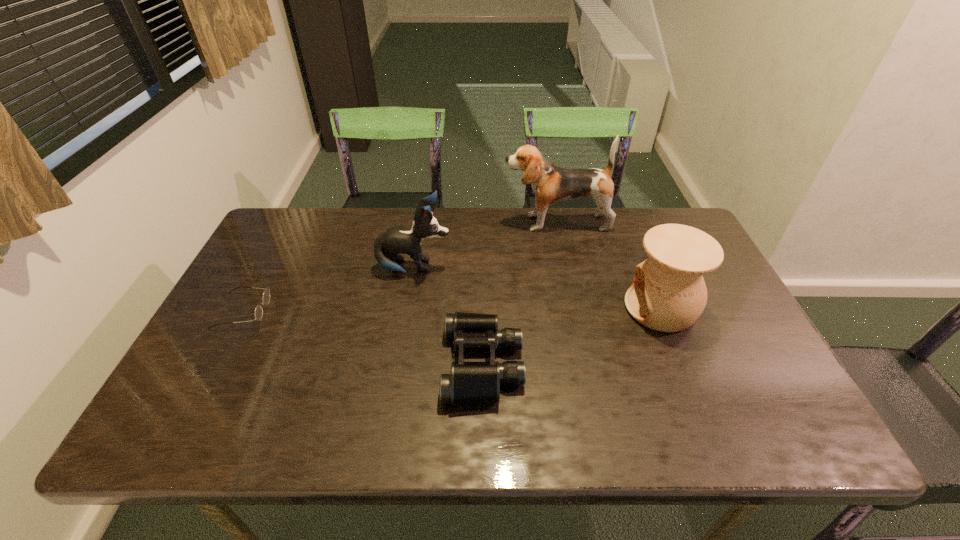
The height and width of the screenshot is (540, 960). What are the coordinates of `vacant space that is in between the binoculars and the pottery` in the screenshot? It's located at (572, 336).

At what (x,y) coordinates should I click in order to perform the action: click on vacant area between the left puppy and the pottery. Please return your answer as a coordinate pair (x, y). Looking at the image, I should click on (538, 288).

At what (x,y) coordinates should I click in order to perform the action: click on empty location between the spectacles and the binoculars. Please return your answer as a coordinate pair (x, y). The height and width of the screenshot is (540, 960). Looking at the image, I should click on (363, 337).

Where is `blank region between the leftmost object and the second farthest object`? The image size is (960, 540). blank region between the leftmost object and the second farthest object is located at coordinates (328, 289).

Locate which object is the fourth closest to the pottery. Please provide its 2D coordinates. Your answer should be formatted as a tuple, i.e. [(x, y)], where the tuple contains the x and y coordinates of a point satisfying the conditions above.

[(266, 295)]

Locate an element on the screen. Image resolution: width=960 pixels, height=540 pixels. the fourth closest object relative to the nearer puppy is located at coordinates (668, 294).